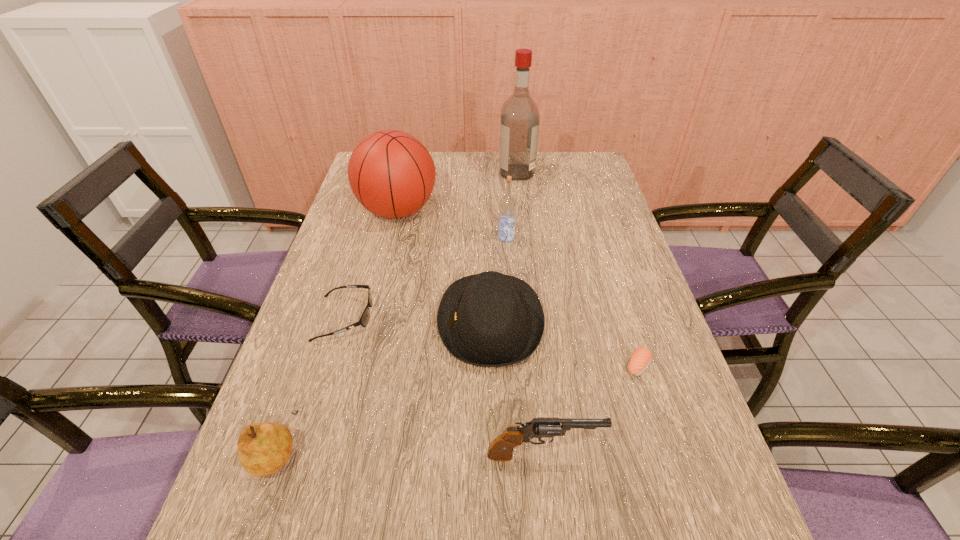
At what (x,y) coordinates should I click in order to perform the action: click on vacant space located 0.170m on the front-facing side of the sunglasses. Please return your answer as a coordinate pair (x, y). The width and height of the screenshot is (960, 540). Looking at the image, I should click on pos(442,318).

In order to click on vacant space positioned 0.210m on the left of the rightmost object in this screenshot , I will do `click(529, 366)`.

Where is `object present at the far edge`? This screenshot has height=540, width=960. object present at the far edge is located at coordinates (519, 124).

At what (x,y) coordinates should I click in order to perform the action: click on basketball that is at the left edge. Please return your answer as a coordinate pair (x, y). The width and height of the screenshot is (960, 540). Looking at the image, I should click on (391, 173).

Find the location of `pear that is at the left edge`. pear that is at the left edge is located at coordinates (263, 448).

Find the location of a particular element. The image size is (960, 540). sunglasses positioned at the left edge is located at coordinates (364, 319).

You are a GUI agent. You are given a task and a screenshot of the screen. Output one action in this format:
    pyautogui.click(x=<x>, y=<y>)
    Task: Click on the object positioned at the right edge
    This screenshot has width=960, height=540.
    Given the screenshot: What is the action you would take?
    pyautogui.click(x=641, y=358)

In the image, there is a desktop. What are the coordinates of `blank space at the far edge` in the screenshot? It's located at (555, 175).

The image size is (960, 540). What are the coordinates of `vacant space at the left edge of the desktop` in the screenshot? It's located at (370, 237).

In the image, there is a desktop. Identify the location of vacant space at the right edge. (600, 274).